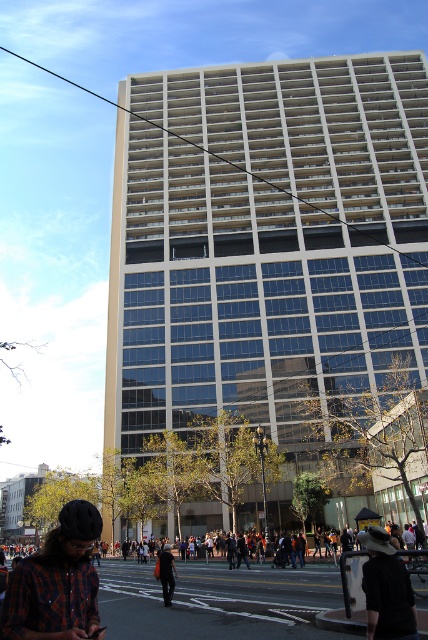
Question: Which point appears farthest from the camera in this image?

Choices:
 (A) (386, 552)
 (B) (163, 557)

Answer: (B)

Question: Which point appears farthest from the camera in this image?

Choices:
 (A) (171, 600)
 (B) (403, 630)
 (C) (91, 611)

Answer: (A)

Question: Which of the following is the closest to the observer?

Choices:
 (A) black fabric hat at lower right
 (B) dark blue jeans at center
 (C) plaid flannel shirt at lower left

Answer: (C)

Question: Is plaid flannel shirt at lower left above dark blue jeans at center?

Choices:
 (A) yes
 (B) no

Answer: (A)

Question: Does plaid flannel shirt at lower left appear on the left side of black fabric hat at lower right?

Choices:
 (A) no
 (B) yes

Answer: (B)

Question: Is plaid flannel shirt at lower left to the right of black fabric hat at lower right from the viewer's perspective?

Choices:
 (A) no
 (B) yes

Answer: (A)